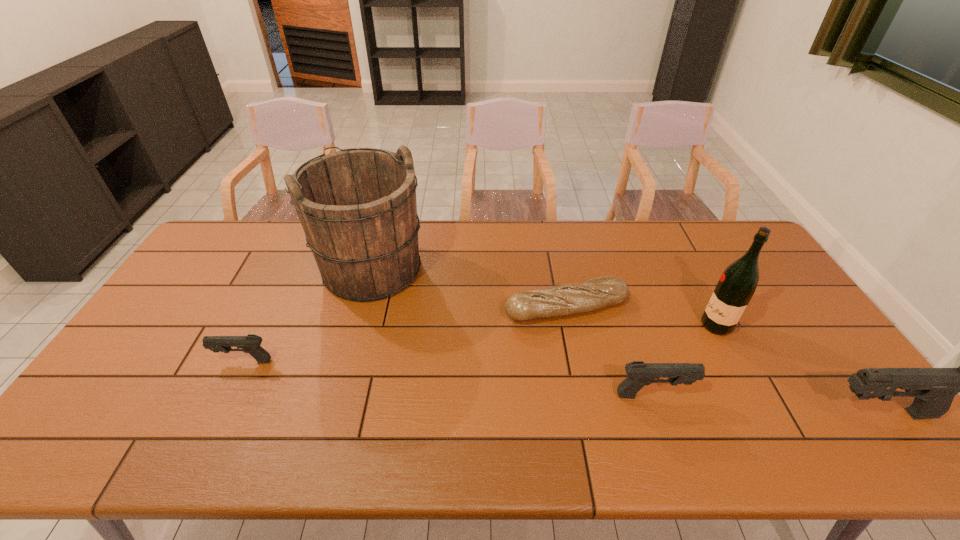
Identify the location of vacant region located on the front-facing side of the second object from right to left. (564, 325).

Locate an element on the screen. The image size is (960, 540). object situated at the far edge is located at coordinates point(357,206).

Where is `object situated at the right edge`? This screenshot has width=960, height=540. object situated at the right edge is located at coordinates (934, 389).

Identify the location of object present at the near right corner. (934, 389).

This screenshot has width=960, height=540. Identify the location of free space at the far edge of the desktop. (459, 227).

Where is `vacant space at the near edge of the desktop`? vacant space at the near edge of the desktop is located at coordinates (511, 418).

Locate an element on the screen. vacant space at the left edge is located at coordinates (115, 374).

At what (x,y) coordinates should I click in order to perform the action: click on blank area at the right edge. Please return your answer as a coordinate pair (x, y). The width and height of the screenshot is (960, 540). Looking at the image, I should click on (807, 359).

At what (x,y) coordinates should I click in order to perform the action: click on vacant space at the far left corner of the desktop. Please return your answer as a coordinate pair (x, y). The image size is (960, 540). Looking at the image, I should click on (239, 233).

The image size is (960, 540). I want to click on free space at the far right corner of the desktop, so click(732, 253).